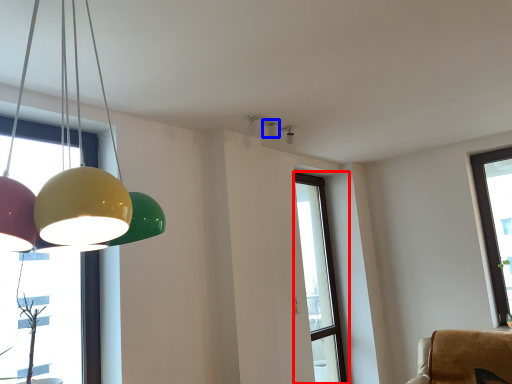
Question: Which point is further to the camera, window (highlighted by a red box) or lamp (highlighted by a blue box)?

Choices:
 (A) window
 (B) lamp

Answer: (A)